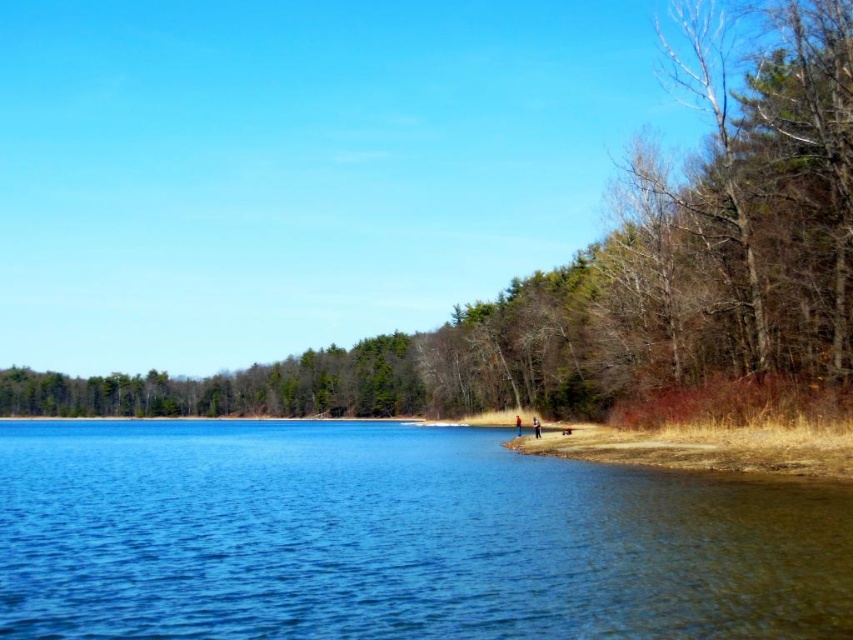
You are standing at the center of the image and want to reach the blue water at lower left. Based on the coordinates provided, in which direction should you move to get there?

The blue water at lower left is located at coordinates point (396,538). Since you are at the center, you should move towards the lower left direction to reach it.